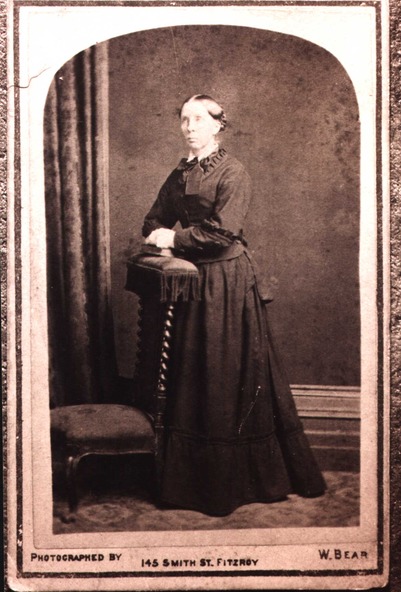
Locate an element on the screen. The width and height of the screenshot is (401, 592). fringe on armrest is located at coordinates (167, 288), (187, 279).